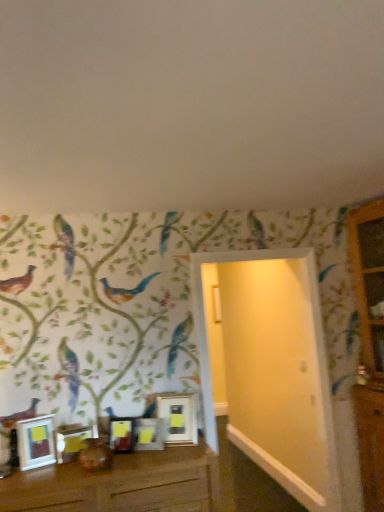
You are a GUI agent. You are given a task and a screenshot of the screen. Output one action in this format:
    pyautogui.click(x=<x>, y=<y>)
    Task: Click on the free spot to the right of matte brown vase at center
    The height and width of the screenshot is (512, 384).
    Given the screenshot: What is the action you would take?
    pyautogui.click(x=130, y=465)